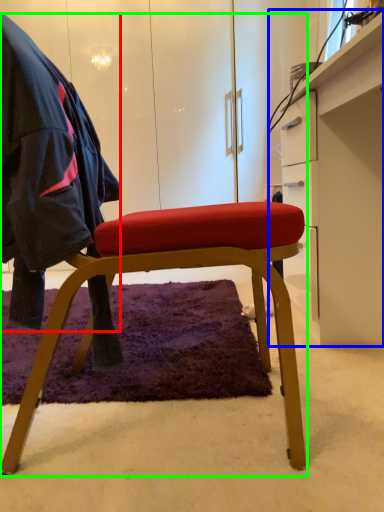
Question: Which is nearer to the cloak (highlighted by a red box)? desk (highlighted by a blue box) or chair (highlighted by a green box).

Choices:
 (A) desk
 (B) chair

Answer: (B)